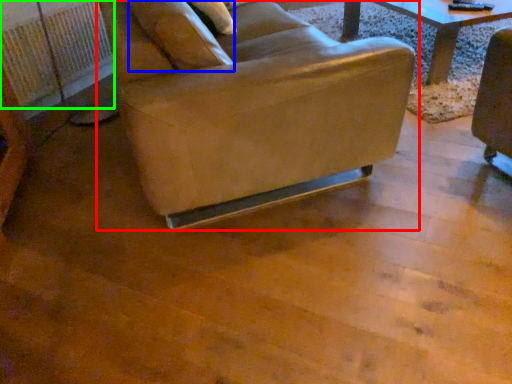
Question: Which object is positioned closest to chair (highlighted by a red box)? Select from pillow (highlighted by a blue box) and radiator (highlighted by a green box).

Choices:
 (A) pillow
 (B) radiator

Answer: (A)